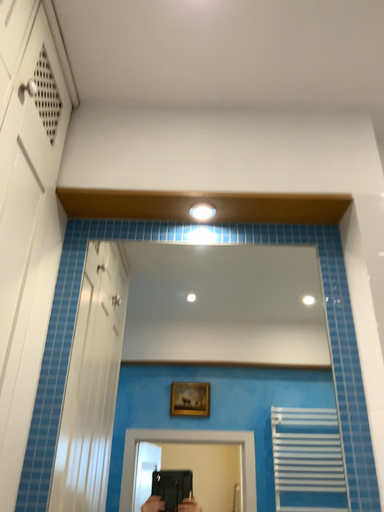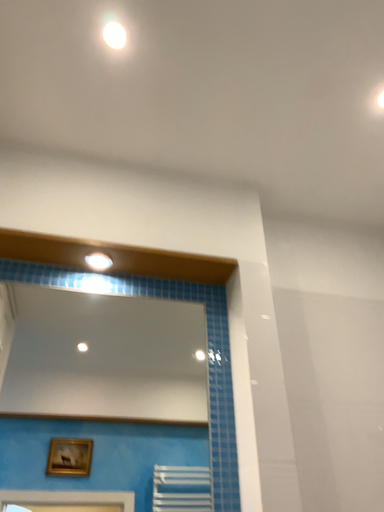
Question: How did the camera likely rotate when shooting the video?

Choices:
 (A) rotated right
 (B) rotated left

Answer: (A)